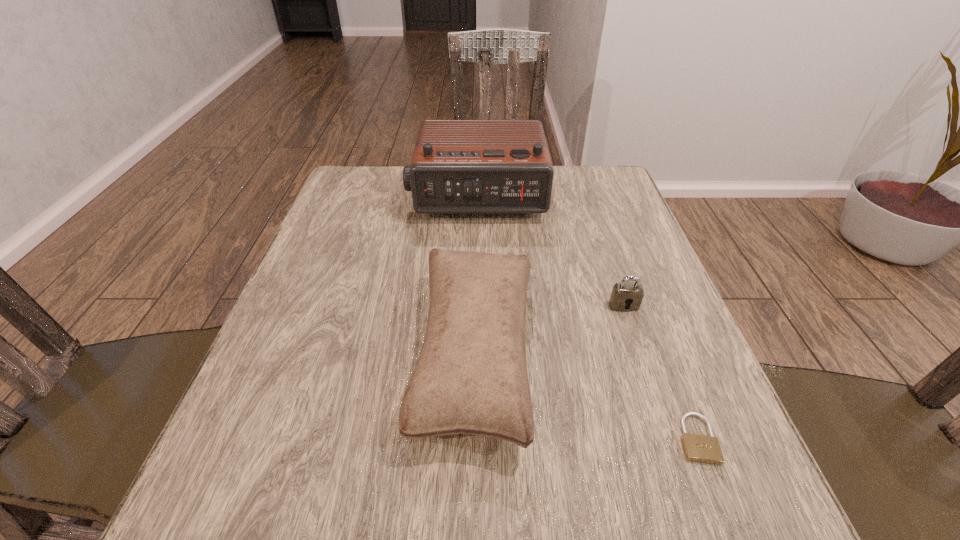
The image size is (960, 540). In order to click on the farthest object in this screenshot , I will do `click(459, 166)`.

Where is `the tallest object`? the tallest object is located at coordinates click(x=459, y=166).

The width and height of the screenshot is (960, 540). Identify the location of the second tallest object. (471, 377).

Image resolution: width=960 pixels, height=540 pixels. Find the location of `the farther padlock`. the farther padlock is located at coordinates (626, 296).

I want to click on the third tallest object, so click(x=626, y=296).

Locate an element on the screen. Image resolution: width=960 pixels, height=540 pixels. the shortest object is located at coordinates (698, 448).

Locate an element on the screen. the shorter padlock is located at coordinates (698, 448).

At what (x,y) coordinates should I click in order to perform the action: click on free location located on the front panel of the radio receiver. Please return your answer as a coordinate pair (x, y). The height and width of the screenshot is (540, 960). Looking at the image, I should click on (475, 354).

You are a GUI agent. You are given a task and a screenshot of the screen. Output one action in this format:
    pyautogui.click(x=<x>, y=<y>)
    Task: Click on the free space located 0.200m on the left of the cushion
    The image size is (960, 540).
    Given the screenshot: What is the action you would take?
    pyautogui.click(x=305, y=354)

Locate an element on the screen. free space located 0.170m at the front of the second shortest object near the keyhole is located at coordinates (651, 385).